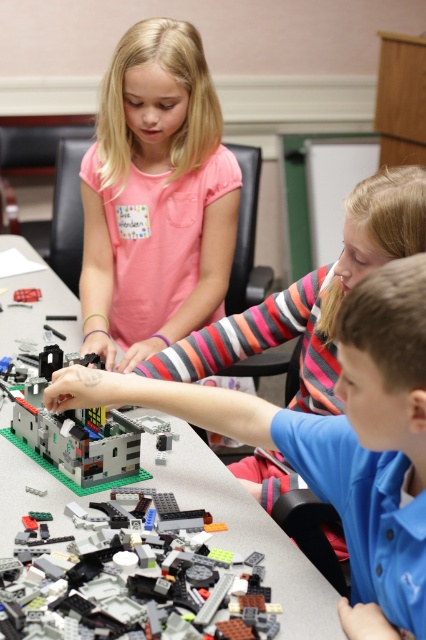
Can you confirm if translucent plastic bricks at center is smaller than green plastic table at center?

Indeed, translucent plastic bricks at center has a smaller size compared to green plastic table at center.

Image resolution: width=426 pixels, height=640 pixels. What do you see at coordinates (132, 579) in the screenshot?
I see `translucent plastic bricks at center` at bounding box center [132, 579].

Image resolution: width=426 pixels, height=640 pixels. Find the location of `translucent plastic bricks at center`. translucent plastic bricks at center is located at coordinates (132, 579).

Can you confirm if matte pink shirt at upper center is positioned to the right of translucent plastic bricks at center?

Incorrect, matte pink shirt at upper center is not on the right side of translucent plastic bricks at center.

Which is behind, point (111, 305) or point (92, 593)?

Point (111, 305)

Image resolution: width=426 pixels, height=640 pixels. In order to click on matte pink shirt at upper center in this screenshot , I will do `click(155, 196)`.

Can you confirm if translucent plastic bricks at center is positioned to the right of translucent gray plastic building at center?

Indeed, translucent plastic bricks at center is positioned on the right side of translucent gray plastic building at center.

From the picture: Can you confirm if translucent plastic bricks at center is thinner than translucent gray plastic building at center?

In fact, translucent plastic bricks at center might be wider than translucent gray plastic building at center.

Who is more forward, (124, 509) or (86, 448)?

Point (124, 509) is in front.

Locate an element on the screen. This screenshot has height=640, width=426. translucent plastic bricks at center is located at coordinates 132,579.